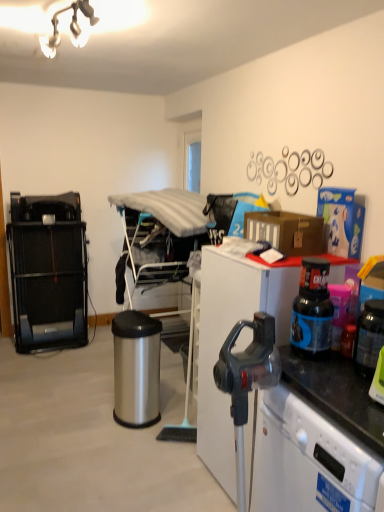
Question: Is translucent plastic bottle at right situated inside metal/textured drying rack at center or outside?

Choices:
 (A) outside
 (B) inside

Answer: (A)

Question: From a real-world perspective, is translucent plastic bottle at right positioned above or below metal/textured drying rack at center?

Choices:
 (A) below
 (B) above

Answer: (B)

Question: Which of these objects is positioned closest to the metal/textured drying rack at center?

Choices:
 (A) black metal treadmill at left
 (B) black plastic bottle at right
 (C) polished stainless steel trash can at center
 (D) translucent plastic bottle at right
 (E) brown cardboard box at upper right

Answer: (C)

Question: Considering the real-world distances, which object is closest to the white glossy dishwasher at lower right?

Choices:
 (A) polished stainless steel trash can at center
 (B) metal/textured drying rack at center
 (C) black plastic bottle at right
 (D) black metal treadmill at left
 (E) white matte desk at right

Answer: (C)